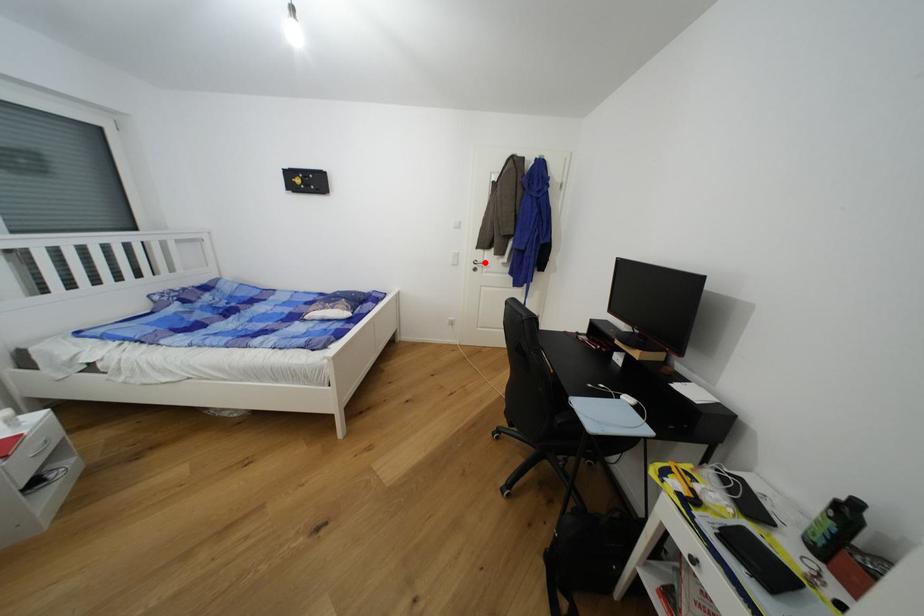
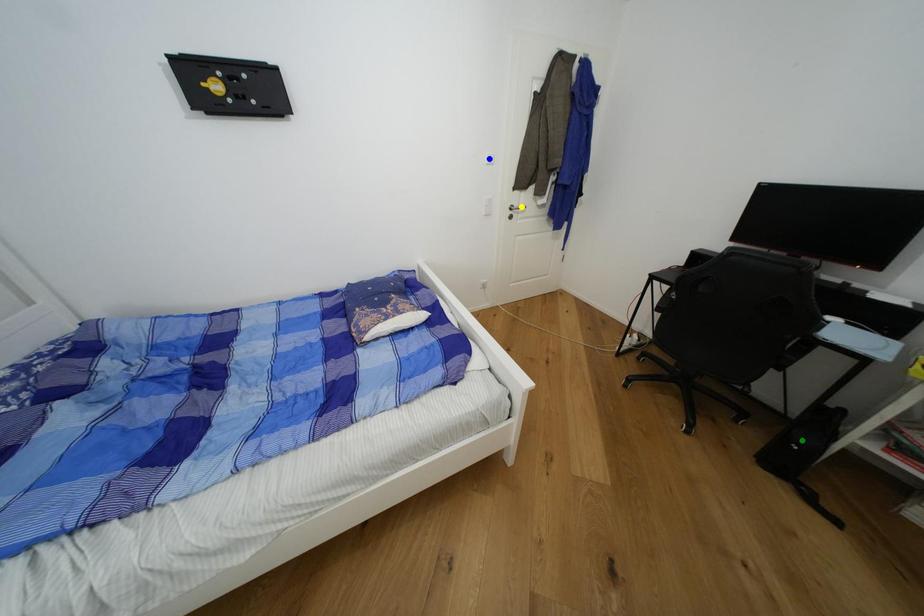
Question: I am providing you with two images of the same scene from different viewpoints. A red point is marked on the first image. You are given multiple points on the second image. Which point in image 2 represents the same 3d spot as the red point in image 1?

Choices:
 (A) yellow point
 (B) blue point
 (C) green point

Answer: (A)